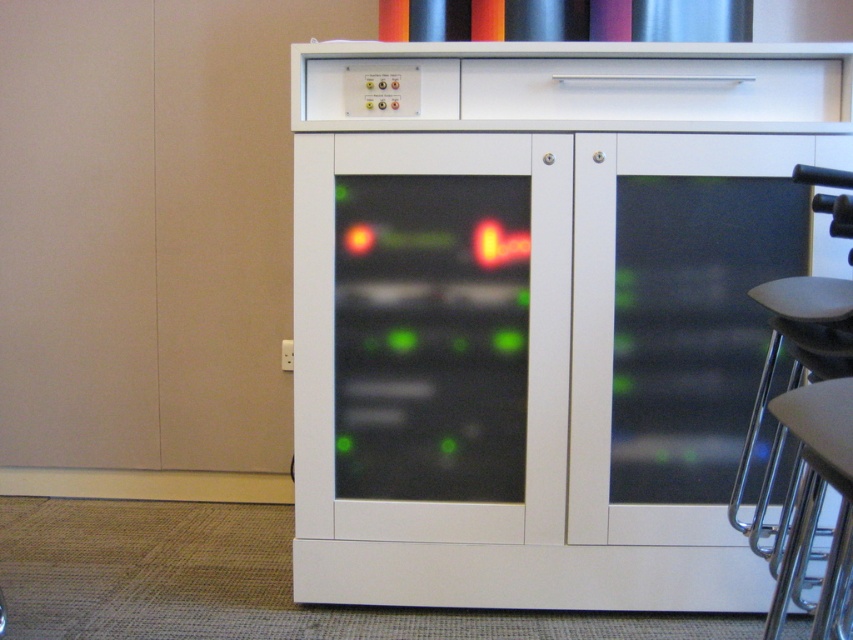
Which is in front, point (335, 595) or point (770, 632)?

Point (770, 632) is more forward.

Can you confirm if white glossy cabinet at center is taller than metallic silver bar stool at lower right?

Correct, white glossy cabinet at center is much taller as metallic silver bar stool at lower right.

What do you see at coordinates (543, 312) in the screenshot?
I see `white glossy cabinet at center` at bounding box center [543, 312].

Identify the location of white glossy cabinet at center. The width and height of the screenshot is (853, 640). (543, 312).

Can you confirm if white glossy cabinet at center is positioned below metallic gray seat at right?

Incorrect, white glossy cabinet at center is not positioned below metallic gray seat at right.

Which is above, white glossy cabinet at center or metallic gray seat at right?

white glossy cabinet at center is higher up.

Between point (413, 486) and point (782, 289), which one is positioned behind?

Point (413, 486)

Locate an element on the screen. This screenshot has height=640, width=853. white glossy cabinet at center is located at coordinates (543, 312).

Is metallic gray seat at right taller than metallic silver bar stool at lower right?

Correct, metallic gray seat at right is much taller as metallic silver bar stool at lower right.

Does metallic gray seat at right appear on the right side of metallic silver bar stool at lower right?

Yes, metallic gray seat at right is to the right of metallic silver bar stool at lower right.

Is point (799, 362) closer to camera compared to point (764, 632)?

No.

Locate an element on the screen. metallic gray seat at right is located at coordinates (805, 449).